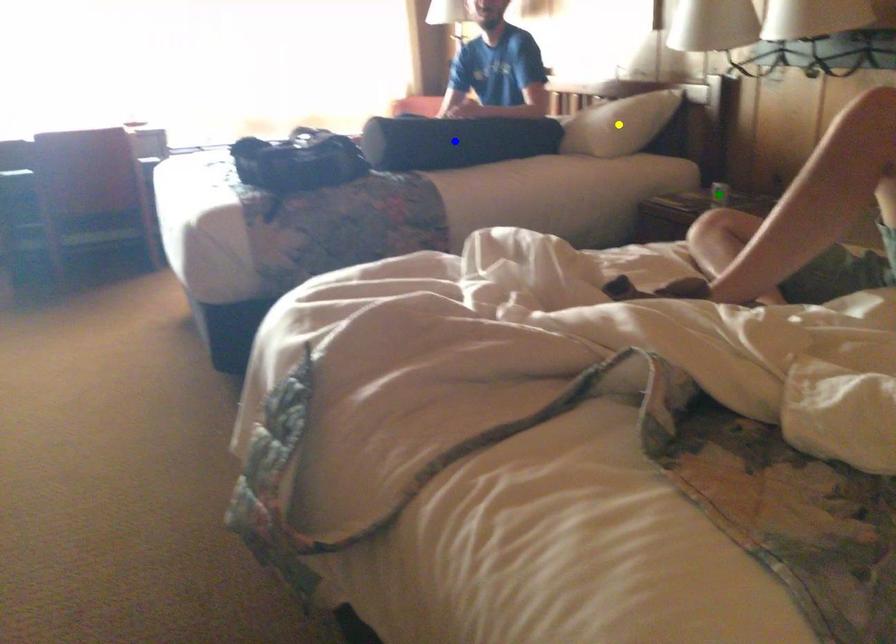
Order these from nearest to farthest:
yellow point, blue point, green point

1. green point
2. yellow point
3. blue point